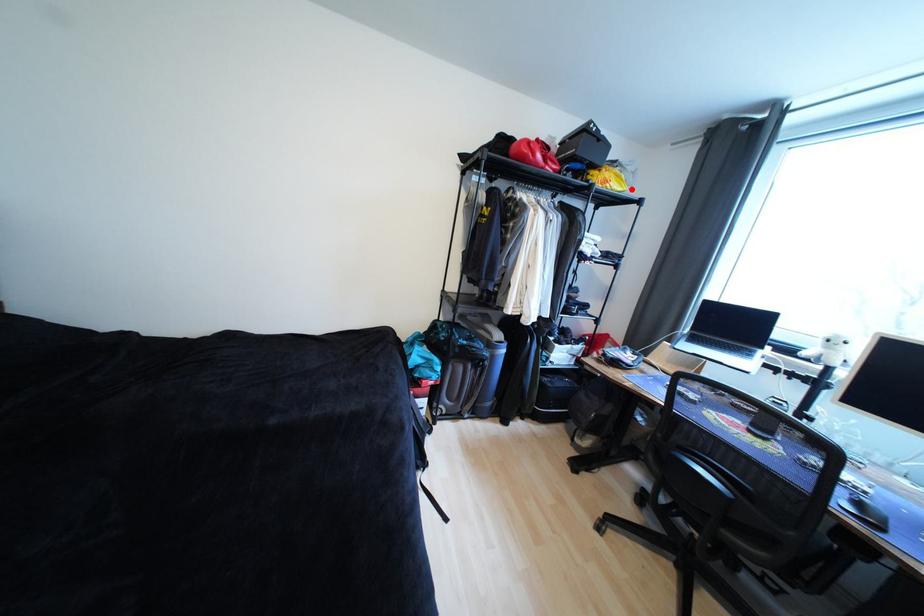
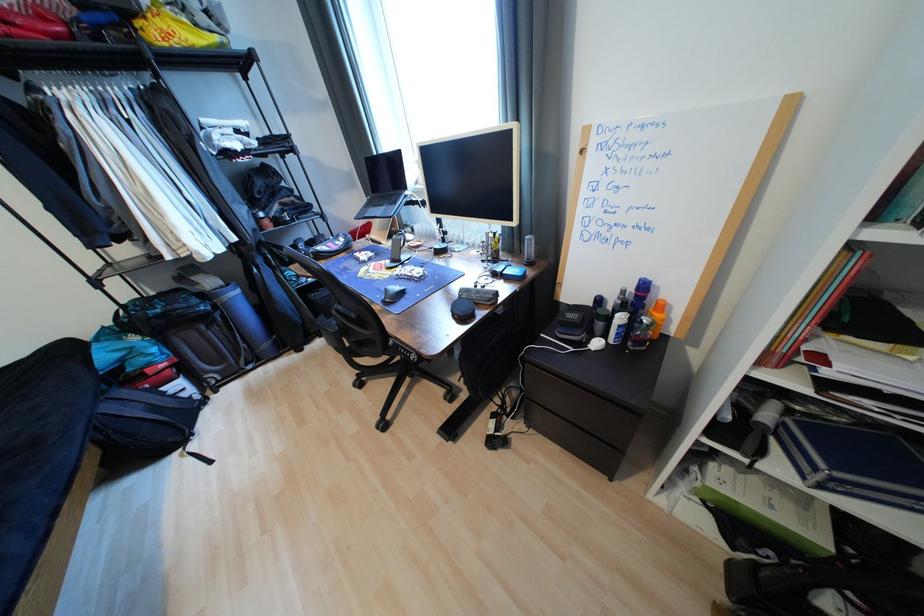
Where in the second image is the point corresponding to the highlighted location from the first image?

(223, 39)